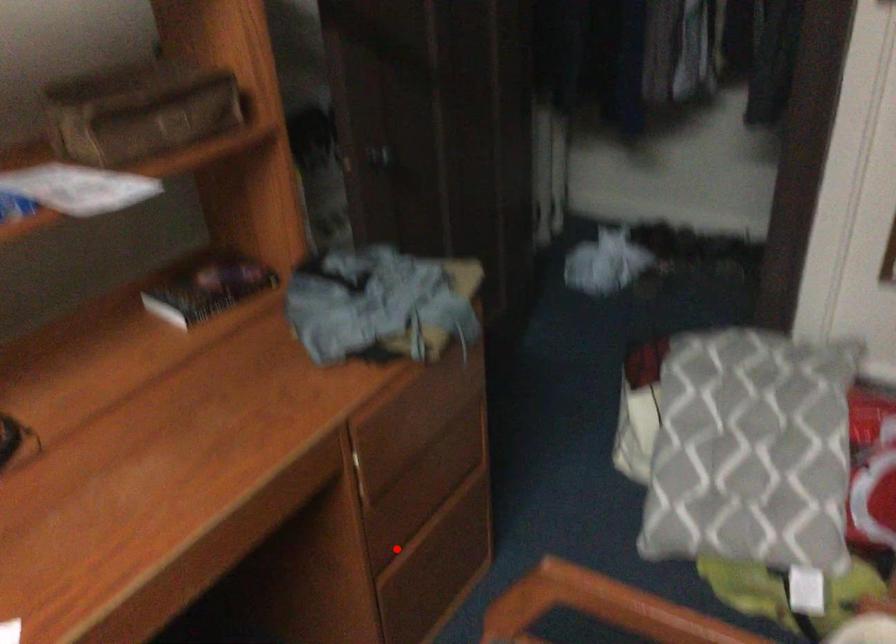
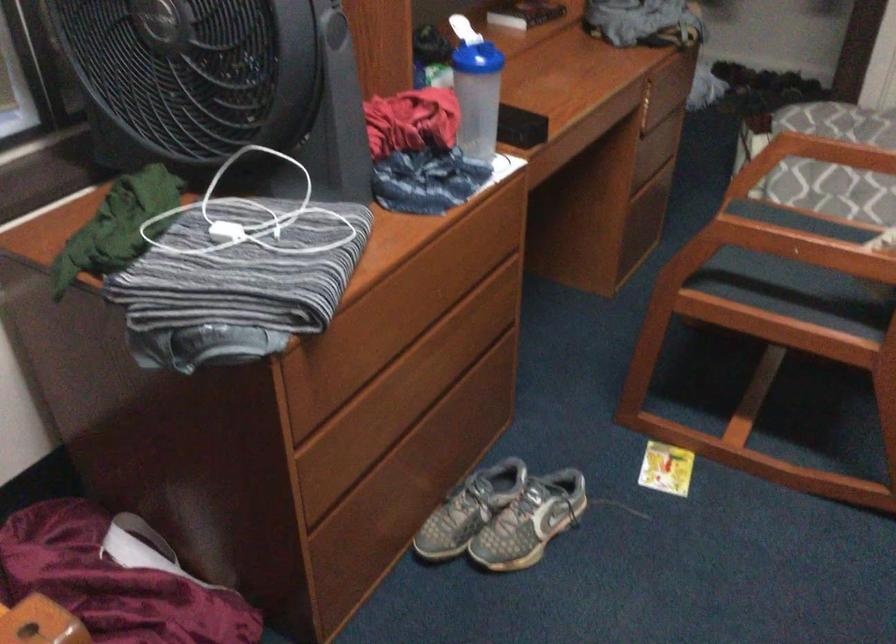
Question: I am providing you with two images of the same scene from different viewpoints. In image1, a red point is highlighted. Considering the same 3D point in image2, which of the following is correct?

Choices:
 (A) It is closer
 (B) It is farther

Answer: (B)